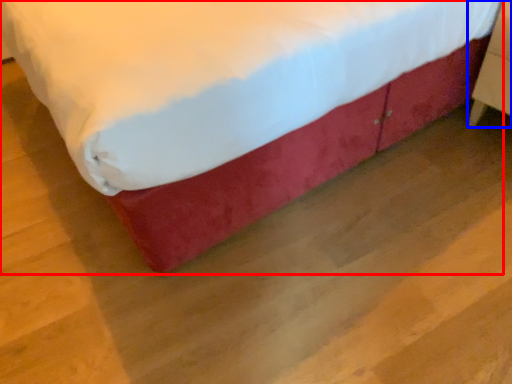
Question: Which of the following is the closest to the observer, bed (highlighted by a red box) or furniture (highlighted by a blue box)?

Choices:
 (A) bed
 (B) furniture

Answer: (A)